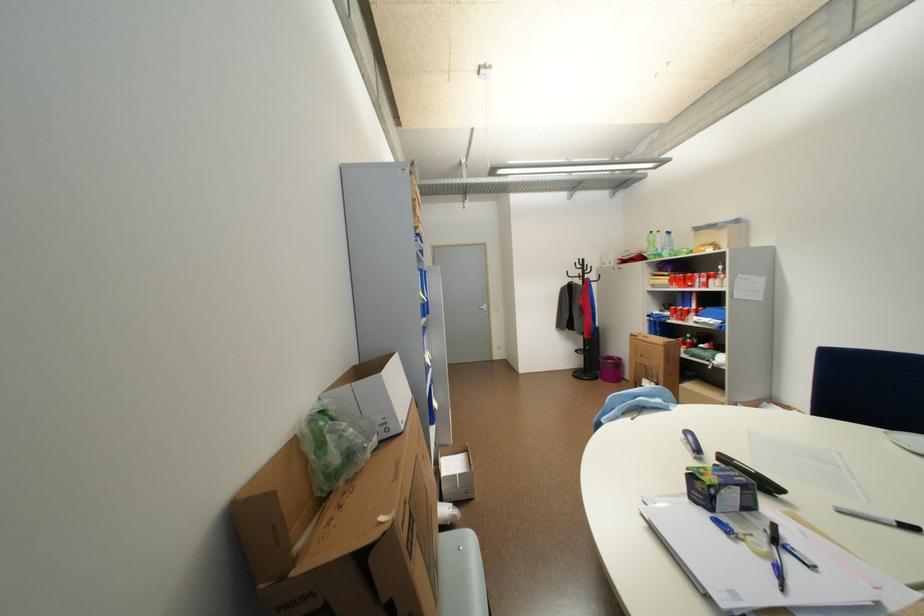
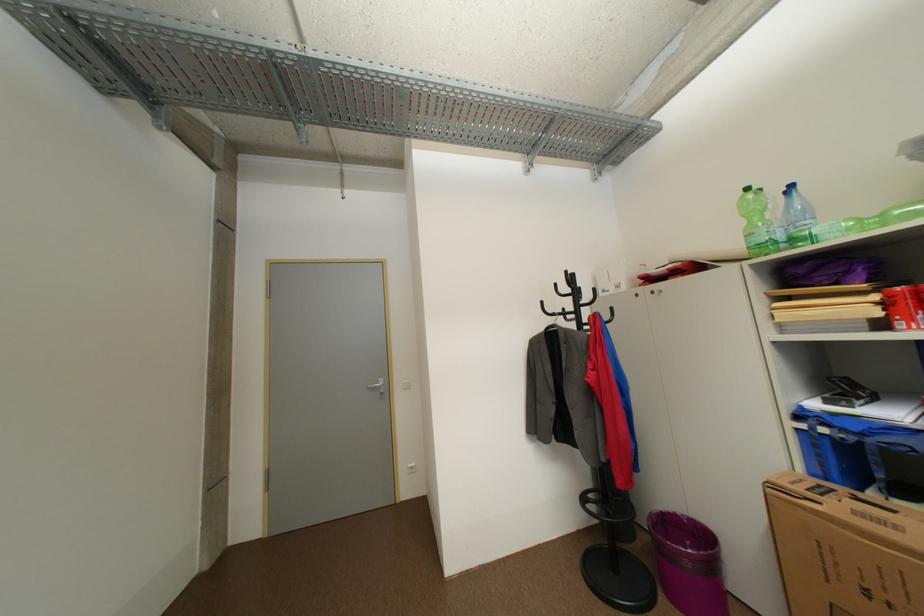
Question: In a continuous first-person perspective shot, in which direction is the camera moving?

Choices:
 (A) Left
 (B) Right
 (C) Forward
 (D) Backward

Answer: (C)